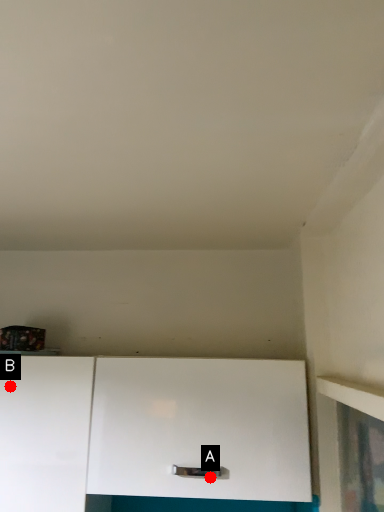
Question: Two points are circled on the image, labeled by A and B beside each circle. Which point is closer to the camera taking this photo?

Choices:
 (A) A is closer
 (B) B is closer

Answer: (A)